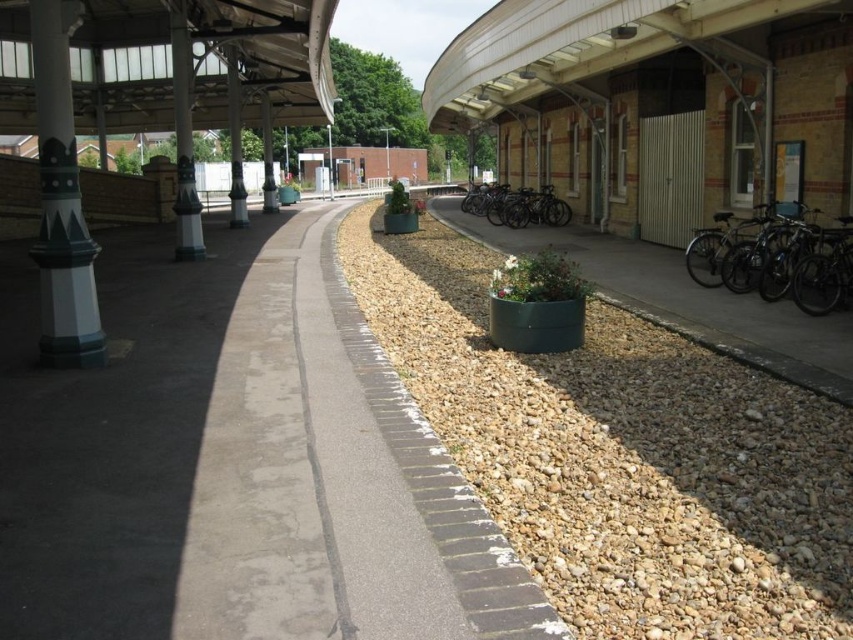
Is gray concrete pavement at center to the left of brushed metal pillar at center from the viewer's perspective?

In fact, gray concrete pavement at center is to the right of brushed metal pillar at center.

Is gray concrete pavement at center further to camera compared to brushed metal pillar at center?

No, gray concrete pavement at center is closer to the viewer.

This screenshot has width=853, height=640. What do you see at coordinates (236, 465) in the screenshot?
I see `gray concrete pavement at center` at bounding box center [236, 465].

Image resolution: width=853 pixels, height=640 pixels. I want to click on gray concrete pavement at center, so click(x=236, y=465).

Does brown gravel at center appear on the left side of green painted concrete pillar at left?

Incorrect, brown gravel at center is not on the left side of green painted concrete pillar at left.

Measure the distance between brown gravel at center and green painted concrete pillar at left.

The distance of brown gravel at center from green painted concrete pillar at left is 5.90 meters.

Is point (376, 253) farther from camera compared to point (49, 140)?

Yes, point (376, 253) is behind point (49, 140).

Where is `brown gravel at center`? This screenshot has width=853, height=640. brown gravel at center is located at coordinates (622, 454).

Does point (474, 481) come behind point (825, 268)?

No, (474, 481) is closer to viewer.

Is brown gravel at center closer to the viewer compared to shiny metallic bicycles at right?

That is True.

Who is more forward, (584, 348) or (824, 284)?

Point (584, 348)

The height and width of the screenshot is (640, 853). Identify the location of brown gravel at center. (622, 454).